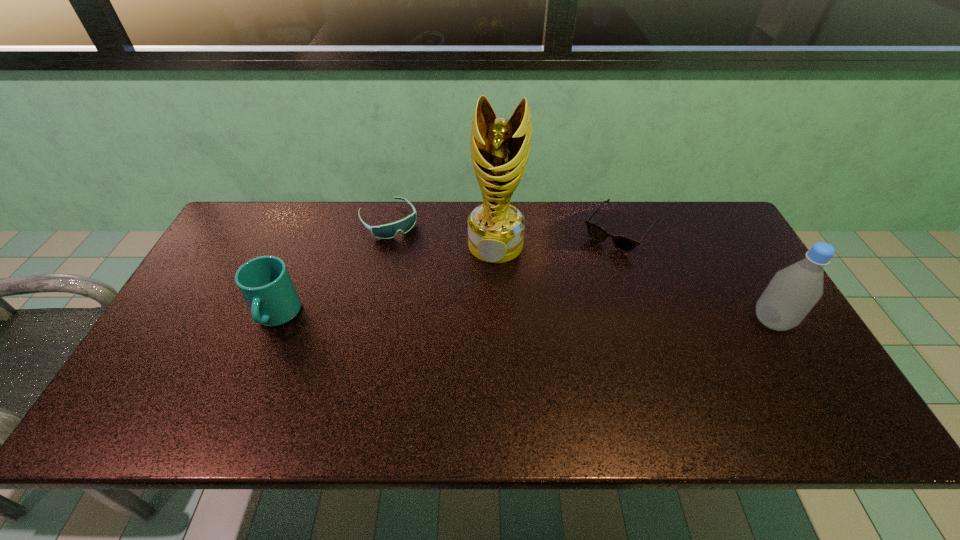
This screenshot has width=960, height=540. Identify the location of sunglasses that is at the far edge. (622, 243).

Find the location of `goggles at the far edge`. goggles at the far edge is located at coordinates (387, 231).

I want to click on object that is at the right edge, so click(793, 291).

At what (x,y) coordinates should I click in order to perform the action: click on free spot at the far edge of the desktop. Please return your answer as a coordinate pair (x, y). Looking at the image, I should click on (440, 201).

At what (x,y) coordinates should I click in order to perform the action: click on vacant space at the near edge of the desktop. Please return your answer as a coordinate pair (x, y). Looking at the image, I should click on (266, 367).

In the image, there is a desktop. Where is `vacant area at the left edge`? This screenshot has height=540, width=960. vacant area at the left edge is located at coordinates (209, 346).

Where is `free space at the right edge of the desktop`? The width and height of the screenshot is (960, 540). free space at the right edge of the desktop is located at coordinates (743, 260).

This screenshot has height=540, width=960. In the image, there is a desktop. Identify the location of vacant space at the far left corner. (253, 241).

In the image, there is a desktop. Find the location of `vacant region at the far right corner`. vacant region at the far right corner is located at coordinates (723, 245).

Identify the location of vacant region at the near right corner of the desktop. (827, 394).